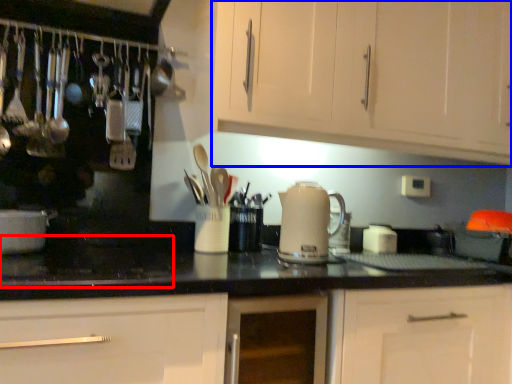
Question: Which of the following is the farthest to the observer, gas stove (highlighted by a red box) or cabinetry (highlighted by a blue box)?

Choices:
 (A) gas stove
 (B) cabinetry

Answer: (B)